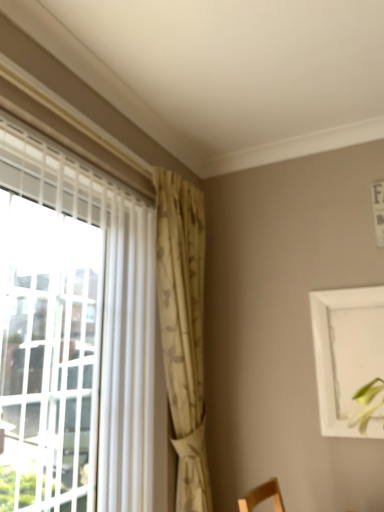
Question: Does white matte picture frame at upper right have a greater height compared to beige textured curtain at center?

Choices:
 (A) yes
 (B) no

Answer: (B)

Question: Is white matte picture frame at upper right oriented towards beige textured curtain at center?

Choices:
 (A) yes
 (B) no

Answer: (B)

Question: Is beige textured curtain at center located within white matte picture frame at upper right?

Choices:
 (A) yes
 (B) no

Answer: (B)

Question: From the image's perspective, is white matte picture frame at upper right above beige textured curtain at center?

Choices:
 (A) yes
 (B) no

Answer: (B)

Question: Considering the relative positions of white matte picture frame at upper right and beige textured curtain at center in the image provided, is white matte picture frame at upper right to the right of beige textured curtain at center from the viewer's perspective?

Choices:
 (A) no
 (B) yes

Answer: (B)

Question: From the image's perspective, does white matte picture frame at upper right appear lower than beige textured curtain at center?

Choices:
 (A) no
 (B) yes

Answer: (B)

Question: Is beige textured curtain at center positioned before white matte picture frame at upper right?

Choices:
 (A) yes
 (B) no

Answer: (A)

Question: Is the depth of beige textured curtain at center greater than that of white matte picture frame at upper right?

Choices:
 (A) no
 (B) yes

Answer: (A)

Question: From a real-world perspective, is beige textured curtain at center located beneath white matte picture frame at upper right?

Choices:
 (A) yes
 (B) no

Answer: (B)

Question: Are beige textured curtain at center and white matte picture frame at upper right beside each other?

Choices:
 (A) yes
 (B) no

Answer: (B)

Question: Could you tell me if beige textured curtain at center is facing white matte picture frame at upper right?

Choices:
 (A) yes
 (B) no

Answer: (B)

Question: From the image's perspective, does beige textured curtain at center appear higher than white matte picture frame at upper right?

Choices:
 (A) no
 (B) yes

Answer: (B)

Question: In the image, is beige textured curtain at center positioned in front of or behind white matte picture frame at upper right?

Choices:
 (A) behind
 (B) front

Answer: (B)